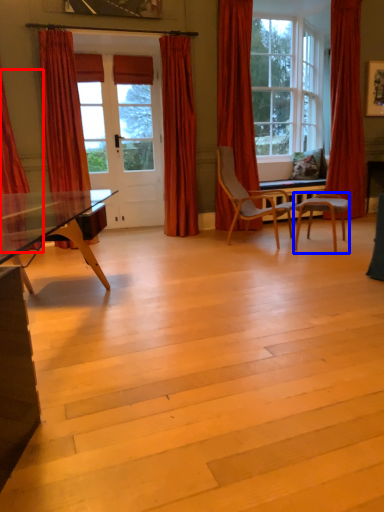
Question: Which object appears farthest to the camera in this image, curtain (highlighted by a red box) or chair (highlighted by a blue box)?

Choices:
 (A) curtain
 (B) chair

Answer: (B)